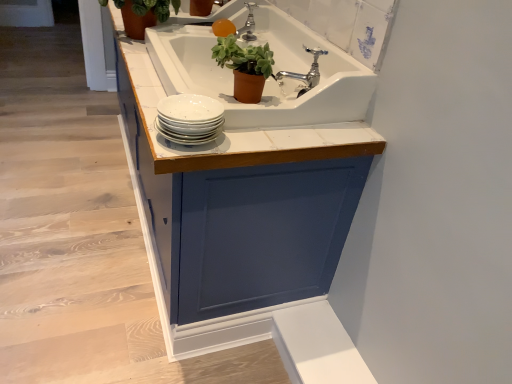
Question: From a real-world perspective, is white glossy cabinet at upper center beneath white glossy plates at center?

Choices:
 (A) no
 (B) yes

Answer: (B)

Question: Is white glossy cabinet at upper center outside of white glossy plates at center?

Choices:
 (A) no
 (B) yes

Answer: (B)

Question: Is the position of white glossy cabinet at upper center more distant than that of white glossy plates at center?

Choices:
 (A) no
 (B) yes

Answer: (B)

Question: Considering the relative sizes of white glossy cabinet at upper center and white glossy plates at center in the image provided, is white glossy cabinet at upper center thinner than white glossy plates at center?

Choices:
 (A) no
 (B) yes

Answer: (A)

Question: Can white glossy plates at center be found inside white glossy cabinet at upper center?

Choices:
 (A) yes
 (B) no

Answer: (B)

Question: From their relative heights in the image, would you say white glossy plates at center is taller or shorter than chrome metallic faucet at upper center, which appears as the first tap when ordered from the bottom?

Choices:
 (A) tall
 (B) short

Answer: (B)

Question: From a real-world perspective, is white glossy plates at center positioned above or below chrome metallic faucet at upper center, which appears as the first tap when ordered from the bottom?

Choices:
 (A) below
 (B) above

Answer: (A)

Question: Is white glossy plates at center to the left or to the right of chrome metallic faucet at upper center, which is counted as the second tap, starting from the back, in the image?

Choices:
 (A) right
 (B) left

Answer: (B)

Question: From the image's perspective, is white glossy plates at center positioned above or below chrome metallic faucet at upper center, which ranks as the 2th tap in top-to-bottom order?

Choices:
 (A) below
 (B) above

Answer: (A)

Question: Is point (232, 44) positioned closer to the camera than point (291, 77)?

Choices:
 (A) closer
 (B) farther

Answer: (A)

Question: Would you say green matte plant pot at upper center, which is the first houseplant in front-to-back order, is to the left or to the right of chrome metallic faucet at upper center, which ranks as the 2th tap in top-to-bottom order, in the picture?

Choices:
 (A) left
 (B) right

Answer: (A)

Question: From the image's perspective, is green matte plant pot at upper center, the 1th houseplant in the bottom-to-top sequence, above or below chrome metallic faucet at upper center, which ranks as the 2th tap in top-to-bottom order?

Choices:
 (A) below
 (B) above

Answer: (A)

Question: Considering the positions of green matte plant pot at upper center, arranged as the 2th houseplant when viewed from the left, and chrome metallic faucet at upper center, which appears as the first tap when ordered from the bottom, in the image, is green matte plant pot at upper center, arranged as the 2th houseplant when viewed from the left, taller or shorter than chrome metallic faucet at upper center, which appears as the first tap when ordered from the bottom,?

Choices:
 (A) tall
 (B) short

Answer: (A)

Question: From the image's perspective, relative to white glossy plates at center, is green matte plant pot at upper center, positioned as the first houseplant in right-to-left order, above or below?

Choices:
 (A) below
 (B) above

Answer: (B)

Question: Based on their sizes in the image, would you say green matte plant pot at upper center, which is the first houseplant in front-to-back order, is bigger or smaller than white glossy plates at center?

Choices:
 (A) big
 (B) small

Answer: (A)